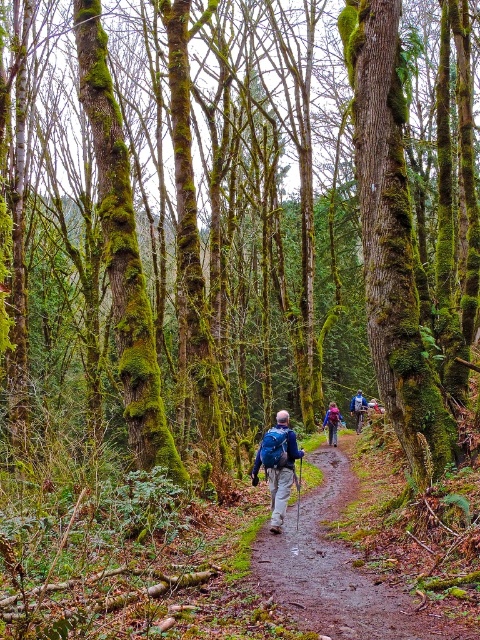
Between point (277, 472) and point (332, 436), which one is positioned in front?

Point (277, 472) is in front.

The image size is (480, 640). What do you see at coordinates (277, 465) in the screenshot? I see `matte blue backpack at center` at bounding box center [277, 465].

Find the location of a particular element. matte blue backpack at center is located at coordinates (277, 465).

Who is higher up, damp dirt path at center or matte purple backpack at center?

damp dirt path at center is above.

Is damp dirt path at center positioned before matte purple backpack at center?

That is True.

Does point (307, 579) come behind point (335, 424)?

No, (307, 579) is closer to viewer.

Identify the location of damp dirt path at center. (339, 568).

Is damp dirt path at center in front of blue fabric backpack at center?

Yes.

Does point (375, 637) come closer to viewer compared to point (355, 416)?

Yes, it is.

This screenshot has width=480, height=640. What are the coordinates of `damp dirt path at center` in the screenshot? It's located at (339, 568).